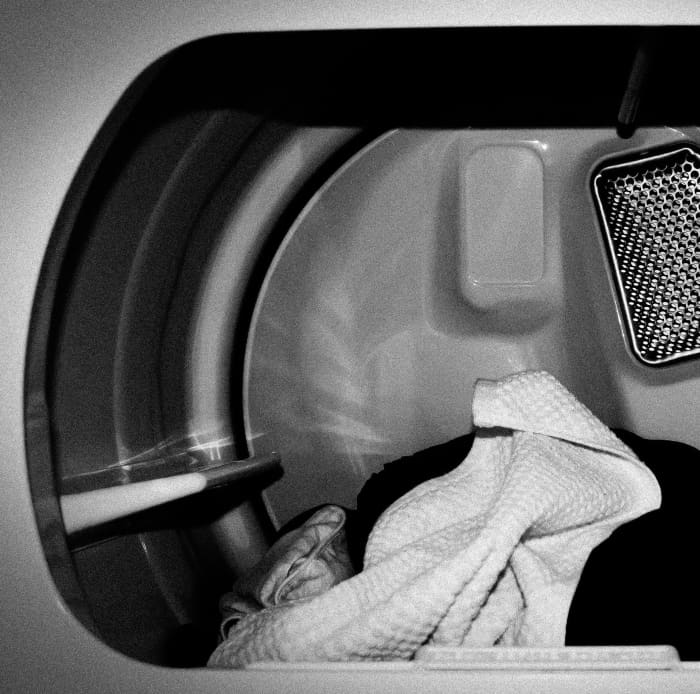
Find the location of a particular element. The width and height of the screenshot is (700, 694). vent in dryer is located at coordinates (x=649, y=271).